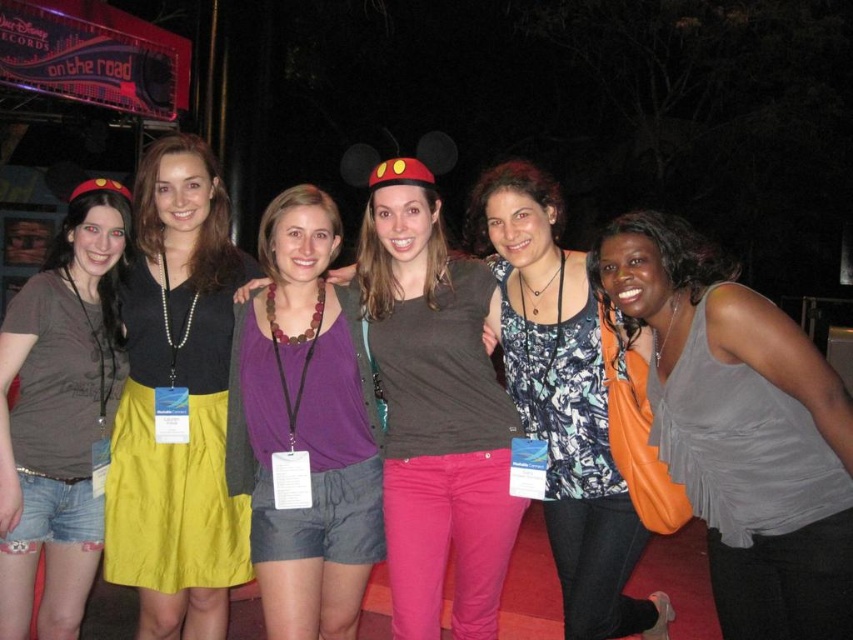
Question: Is purple fabric shirt at center positioned in front of matte black shirt at center?

Choices:
 (A) yes
 (B) no

Answer: (A)

Question: Estimate the real-world distances between objects in this image. Which object is closer to the gray satin tank top at lower right?

Choices:
 (A) yellow fabric skirt at center
 (B) floral tank top at center
 (C) matte black shirt at center
 (D) matte pink pants at center

Answer: (B)

Question: Which object is closer to the camera taking this photo?

Choices:
 (A) floral tank top at center
 (B) matte black shirt at center

Answer: (B)

Question: Estimate the real-world distances between objects in this image. Which object is farther from the floral tank top at center?

Choices:
 (A) gray satin tank top at lower right
 (B) matte black shirt at center

Answer: (B)

Question: Does purple fabric shirt at center appear on the right side of matte black shirt at center?

Choices:
 (A) no
 (B) yes

Answer: (B)

Question: Where is purple fabric shirt at center located in relation to floral tank top at center in the image?

Choices:
 (A) below
 (B) above

Answer: (B)